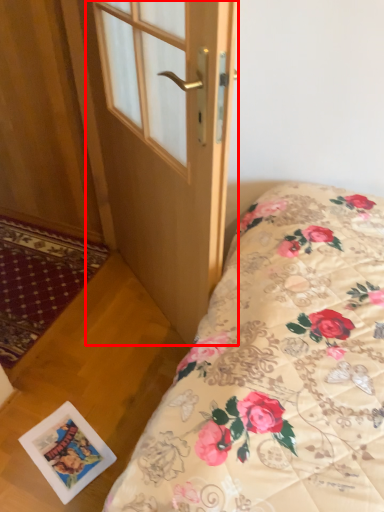
Question: From the image, what is the correct spatial relationship of door (annotated by the red box) in relation to postcard?

Choices:
 (A) right
 (B) left

Answer: (A)